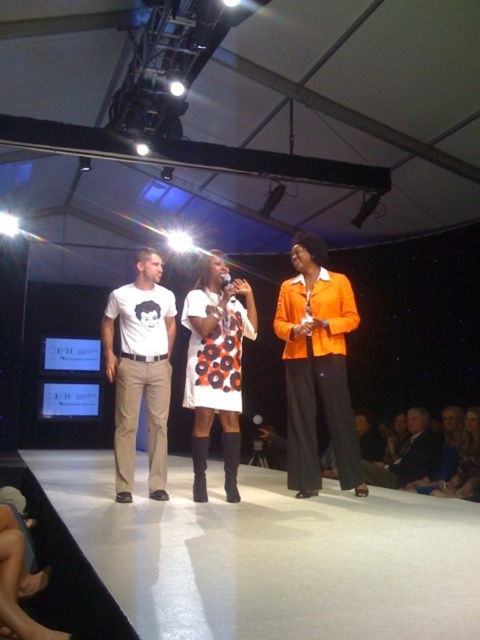
Question: Is white matte t-shirt at center to the right of white dotted dress at center from the viewer's perspective?

Choices:
 (A) no
 (B) yes

Answer: (A)

Question: Which point is farther to the camera?

Choices:
 (A) orange matte blazer at center
 (B) white dotted dress at center
 (C) white matte t-shirt at center

Answer: (A)

Question: Which point appears farthest from the camera in this image?

Choices:
 (A) (118, 484)
 (B) (335, 403)
 (C) (432, 456)
 (D) (228, 452)

Answer: (C)

Question: Which object is closer to the camera taking this photo?

Choices:
 (A) dark gray suit at lower right
 (B) white matte t-shirt at center
 (C) white dotted dress at center

Answer: (B)

Question: Can you confirm if orange matte blazer at center is thinner than dark gray suit at lower right?

Choices:
 (A) no
 (B) yes

Answer: (B)

Question: Is white matte t-shirt at center above dark gray suit at lower right?

Choices:
 (A) no
 (B) yes

Answer: (B)